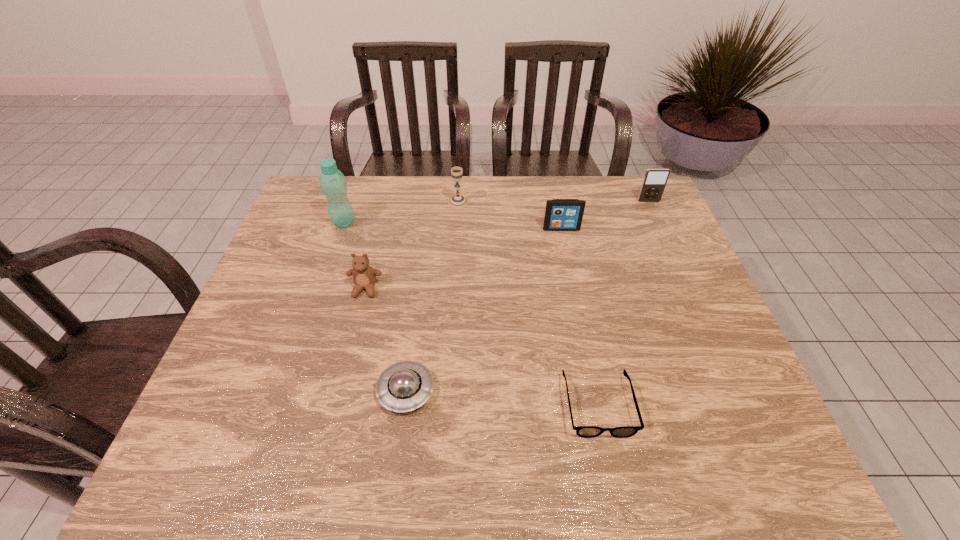
Identify which object is located as the second nearest to the chalice. Please provide its 2D coordinates. Your answer should be formatted as a tuple, i.e. [(x, y)], where the tuple contains the x and y coordinates of a point satisfying the conditions above.

[(333, 184)]

What are the coordinates of `free location that satisfies the following two spatial constraints: 1. on the front-facing side of the saucer; 2. on the right side of the third nearest object` in the screenshot? It's located at (341, 390).